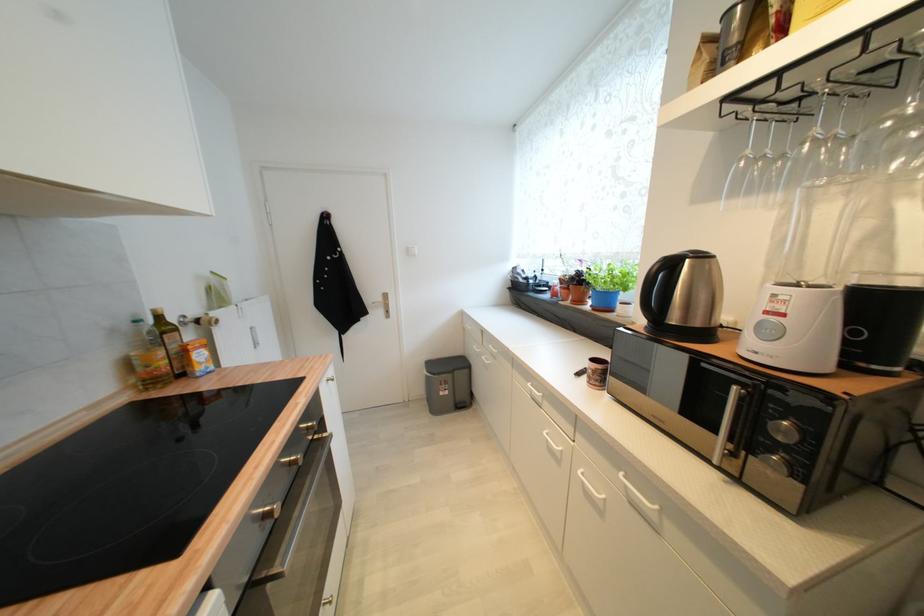
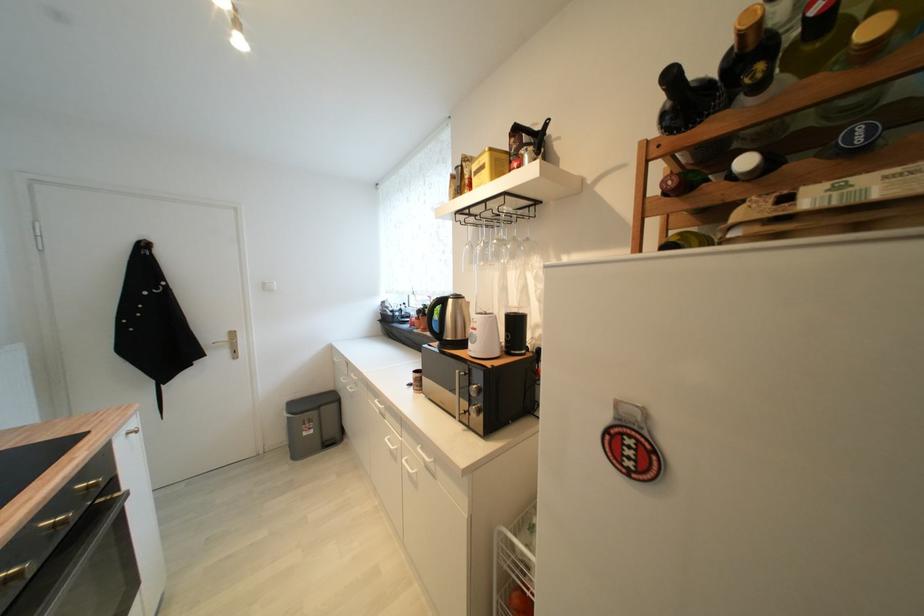
Locate, in the second image, the point that corresponds to the point at 446,395 in the first image.

(310, 436)